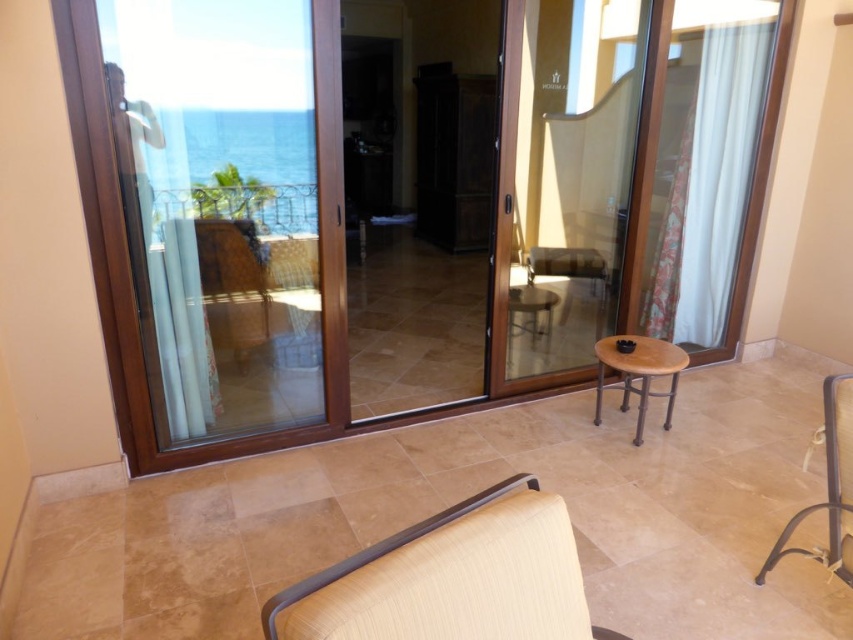
Question: Does metallic wrought iron railing at upper left appear on the left side of brown wooden stool at center?

Choices:
 (A) no
 (B) yes

Answer: (B)

Question: Among these objects, which one is nearest to the camera?

Choices:
 (A) matte wood table at center
 (B) brown wooden stool at center

Answer: (B)

Question: Which object is closer to the camera taking this photo?

Choices:
 (A) matte wood table at center
 (B) beige fabric armchair at lower center
 (C) metallic wrought iron railing at upper left

Answer: (B)

Question: Is beige fabric armchair at lower center to the right of metallic wrought iron railing at upper left from the viewer's perspective?

Choices:
 (A) no
 (B) yes

Answer: (B)

Question: Is beige fabric armchair at lower center to the left of matte wood table at center from the viewer's perspective?

Choices:
 (A) yes
 (B) no

Answer: (A)

Question: Which of the following is the closest to the observer?

Choices:
 (A) metallic wrought iron railing at upper left
 (B) beige fabric armchair at lower center
 (C) brown wooden stool at center

Answer: (B)